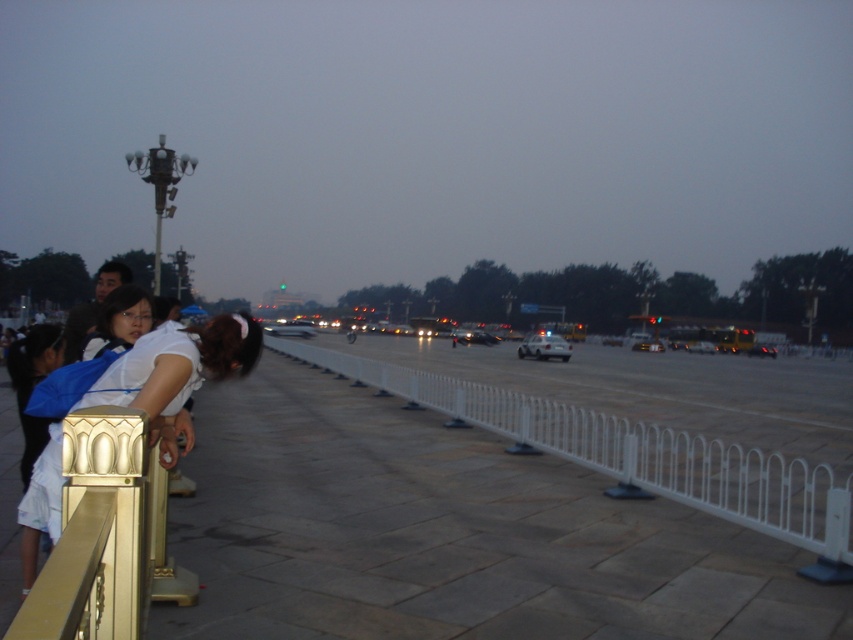
You are standing at the point marked by the coordinate point (635,456), which is the white metal fence at center. You want to walk towards the group of people near the golden ornate railing on the left. Is there any object between you and them that might block your path?

There is no object between you and the group of people near the golden ornate railing on the left, so you can walk directly towards them without obstruction.

You are a delivery person who needs to park your 2.5 meters wide truck between the white metal fence at center and the white glossy car at center. Can you fit your truck there based on the scene?

The white metal fence at center is wider than the white glossy car at center, so the space between them may not be sufficient for a 2.5 meters wide truck. You should look for another parking spot.

From the picture: You are standing at the origin point of the image. Which direction should you move to reach the white metal fence at center?

The white metal fence at center is located at coordinates point (635, 456), so you should move towards the lower right direction from the origin point to reach it.